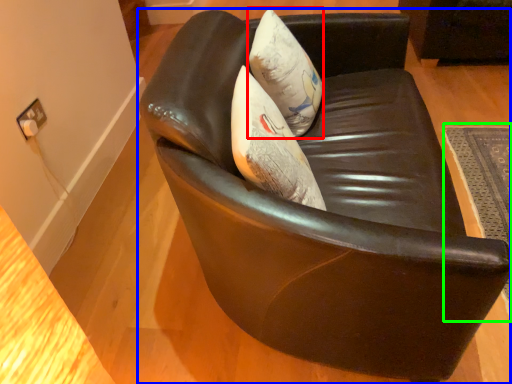
Question: Based on their relative distances, which object is farther from throw pillow (highlighted by a red box)? Choose from chair (highlighted by a blue box) and mat (highlighted by a green box).

Choices:
 (A) chair
 (B) mat

Answer: (B)